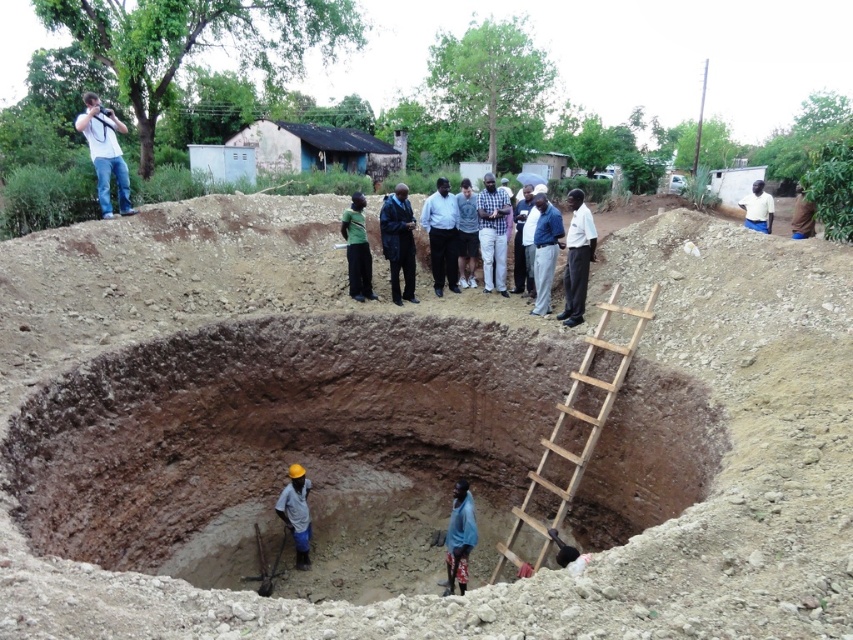
Can you confirm if blue fabric at center is positioned above light brown hard hat at lower center?

Actually, blue fabric at center is below light brown hard hat at lower center.

Which is below, blue fabric at center or light brown hard hat at lower center?

blue fabric at center is lower down.

Is point (447, 579) positioned behind point (291, 467)?

No, (447, 579) is in front of (291, 467).

The width and height of the screenshot is (853, 640). In order to click on blue fabric at center in this screenshot , I will do `click(459, 538)`.

Does checkered fabric shirt at center appear under blue fabric at center?

Incorrect, checkered fabric shirt at center is not positioned below blue fabric at center.

Locate an element on the screen. The image size is (853, 640). checkered fabric shirt at center is located at coordinates (492, 234).

Based on the photo, between brown clay pit at center and checkered fabric shirt at center, which one appears on the right side from the viewer's perspective?

checkered fabric shirt at center is more to the right.

Locate an element on the screen. The image size is (853, 640). brown clay pit at center is located at coordinates (412, 429).

You are a GUI agent. You are given a task and a screenshot of the screen. Output one action in this format:
    pyautogui.click(x=<x>, y=<y>)
    Task: Click on the brown clay pit at center
    The height and width of the screenshot is (640, 853).
    Given the screenshot: What is the action you would take?
    pyautogui.click(x=412, y=429)